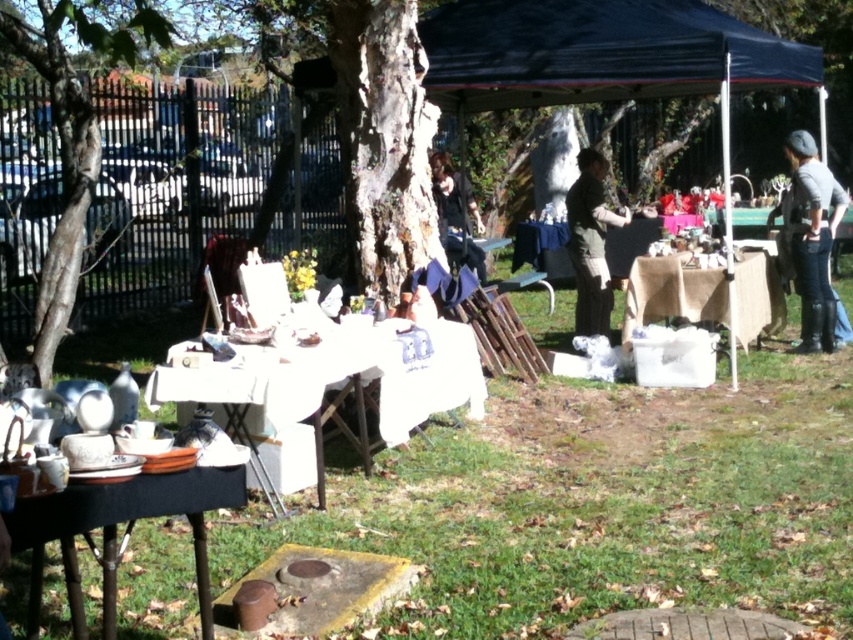
Can you confirm if black fabric table at lower left is smaller than dark brown leather jacket at center?

Yes, black fabric table at lower left is smaller than dark brown leather jacket at center.

Is black fabric table at lower left in front of dark brown leather jacket at center?

Yes, black fabric table at lower left is closer to the viewer.

Based on the photo, who is more distant from viewer, (73, 529) or (601, 192)?

The point (601, 192) is behind.

Identify the location of black fabric table at lower left. Image resolution: width=853 pixels, height=640 pixels. (115, 531).

Which is below, burlap table at center or black fabric jacket at center?

burlap table at center is lower down.

Find the location of `burlap table at center`. burlap table at center is located at coordinates (672, 292).

At what (x,y) coordinates should I click in order to perform the action: click on burlap table at center. Please return your answer as a coordinate pair (x, y). Looking at the image, I should click on (672, 292).

Can you confirm if blue fabric tent at upper center is smaller than black fabric jacket at center?

No.

Does blue fabric tent at upper center lie in front of black fabric jacket at center?

Yes, it is in front of black fabric jacket at center.

The height and width of the screenshot is (640, 853). In order to click on blue fabric tent at upper center in this screenshot , I will do `click(608, 65)`.